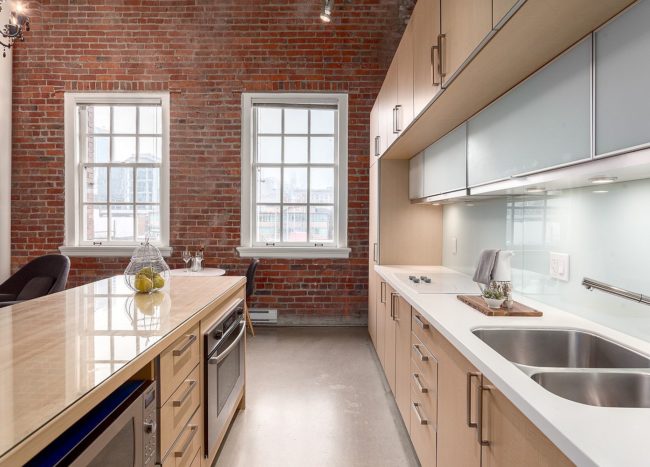
The height and width of the screenshot is (467, 650). Find the location of `cabinet handles`. cabinet handles is located at coordinates (396, 119), (393, 127), (444, 62), (436, 73), (379, 139), (372, 151), (485, 401), (468, 399).